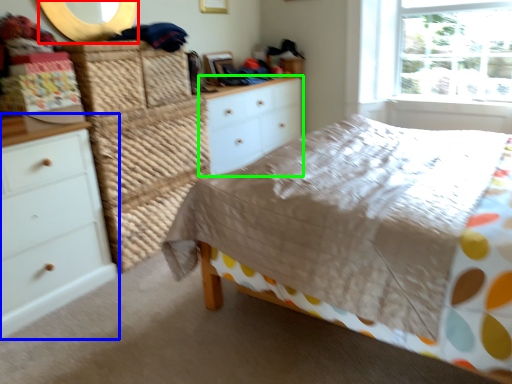
Question: Based on their relative distances, which object is farther from mirror (highlighted by a red box)? Choose from chest of drawers (highlighted by a blue box) and chest of drawers (highlighted by a green box).

Choices:
 (A) chest of drawers
 (B) chest of drawers

Answer: (B)